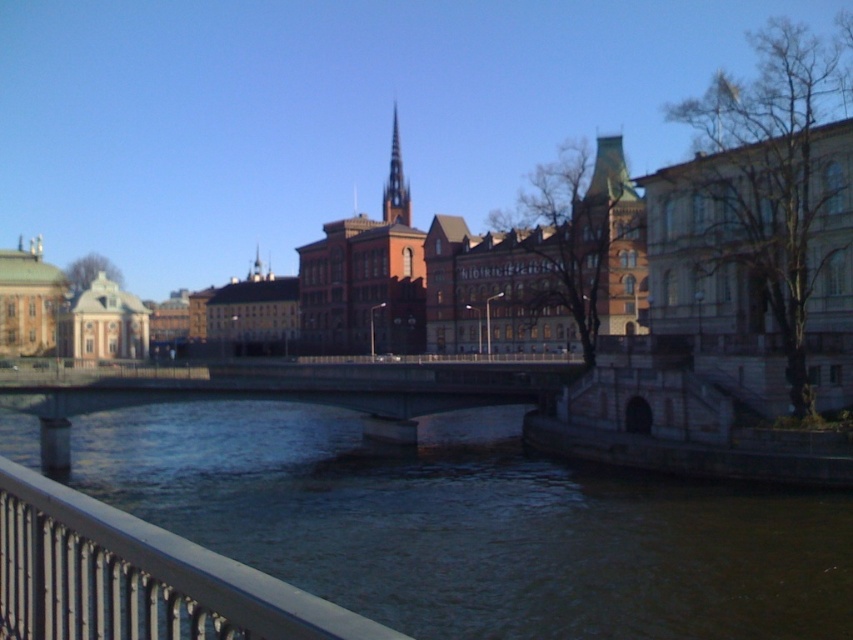
Is brown concrete river at center positioned behind smooth stone spire at center?

No, it is not.

In the scene shown: Who is lower down, brown concrete river at center or smooth stone spire at center?

brown concrete river at center

Which is in front, point (817, 557) or point (393, 170)?

Point (817, 557)

Where is `brown concrete river at center`? This screenshot has height=640, width=853. brown concrete river at center is located at coordinates (474, 525).

Is point (207, 564) positioned in front of point (390, 148)?

Yes, point (207, 564) is in front of point (390, 148).

Describe the element at coordinates (137, 577) in the screenshot. I see `metallic gray railing at lower left` at that location.

At what (x,y) coordinates should I click in order to perform the action: click on metallic gray railing at lower left. Please return your answer as a coordinate pair (x, y). Looking at the image, I should click on (137, 577).

Image resolution: width=853 pixels, height=640 pixels. What do you see at coordinates (474, 525) in the screenshot?
I see `brown concrete river at center` at bounding box center [474, 525].

Can you confirm if brown concrete river at center is positioned to the right of metallic gray railing at lower left?

Incorrect, brown concrete river at center is not on the right side of metallic gray railing at lower left.

Find the location of a particular element. brown concrete river at center is located at coordinates (474, 525).

At what (x,y) coordinates should I click in order to perform the action: click on brown concrete river at center. Please return your answer as a coordinate pair (x, y). Looking at the image, I should click on (474, 525).